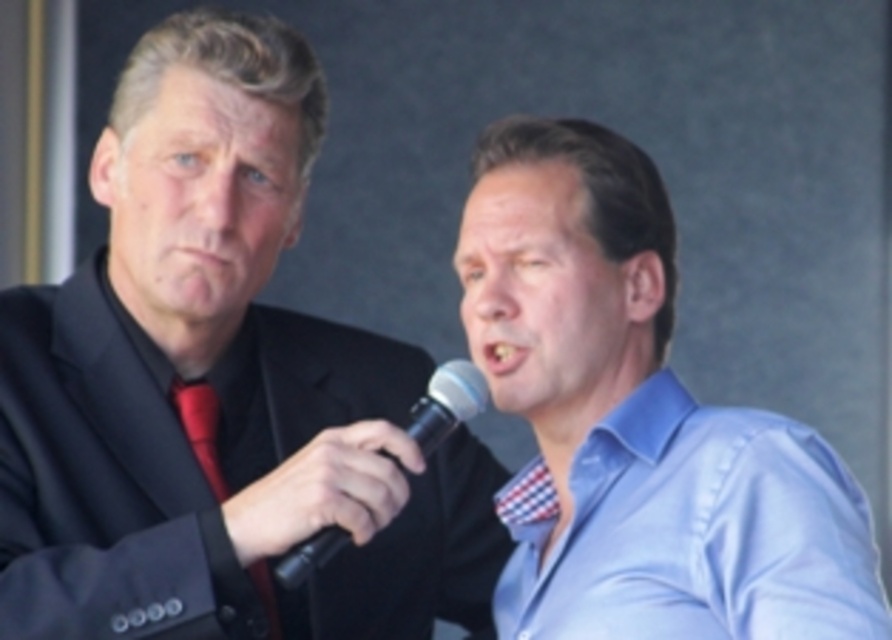
You are a photographer setting up for a photo shoot. You need to ensure that the light blue satin shirt at center and the black plastic microphone at center are both visible in the frame. Which object should you adjust the camera angle to prioritize if the frame can only accommodate one of them due to space constraints?

The light blue satin shirt at center should be prioritized because its width is larger than the black plastic microphone at center, making it more prominent in the frame.

You are a photographer trying to capture a clear shot of the blue satin shirt at center and the black plastic microphone at center. Since both are at center, which one should you focus on to ensure the other is also in focus?

The blue satin shirt at center is in front of the black plastic microphone at center, so focusing on the blue satin shirt at center will ensure the microphone is also in focus.